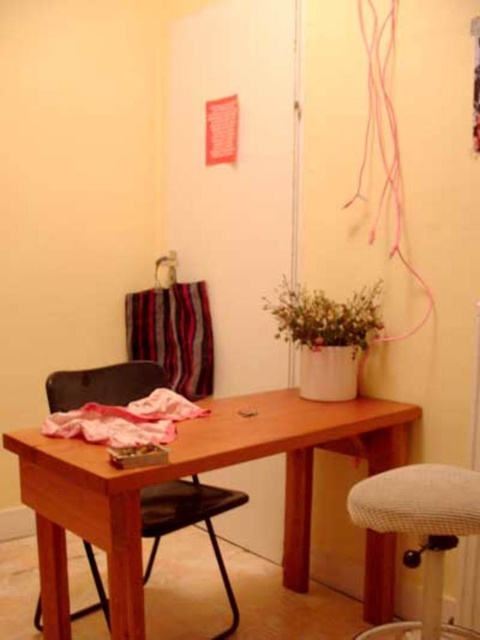
From the picture: You are organizing a small event and need to move the black plastic chair at center closer to the wooden table at center. According to the scene description, which direction should you move the chair?

The wooden table at center is located above the black plastic chair at center, so you should move the black plastic chair at center upward to align it closer to the wooden table at center.

You are a delivery robot that needs to place a package between the wooden table at center and the black plastic chair at center. The package is 12 inches wide. Can the package fit in the space between them?

The distance between the wooden table at center and the black plastic chair at center is 13.30 inches. Since the package is 12 inches wide, it can fit in the space between them as there is enough room.

You are a person who is 160 cm tall and wants to sit comfortably at the desk. Which chair between the white textured bar stool at lower right and the black plastic chair at center would be more suitable for you?

The black plastic chair at center is shorter than the white textured bar stool at lower right. Since you are 160 cm tall, the black plastic chair at center would be more suitable as it provides a lower seating height for comfortable sitting at the desk.